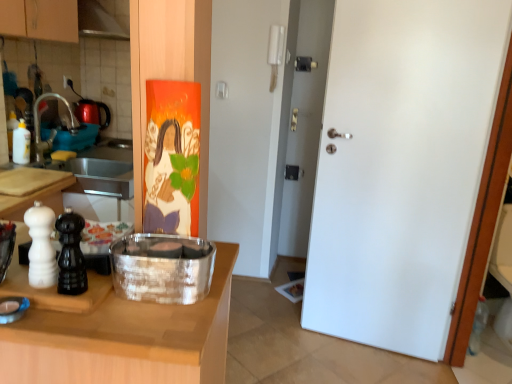
Question: Does silver metallic container at center have a greater width compared to wooden cutting board at left, which appears as the 2th countertop when viewed from the top?

Choices:
 (A) no
 (B) yes

Answer: (A)

Question: Can wooden cutting board at left, which appears as the 2th countertop when viewed from the top, be found inside silver metallic container at center?

Choices:
 (A) no
 (B) yes

Answer: (A)

Question: Can you confirm if silver metallic container at center is bigger than wooden cutting board at left, which appears as the 2th countertop when viewed from the top?

Choices:
 (A) no
 (B) yes

Answer: (A)

Question: Is silver metallic container at center at the right side of wooden cutting board at left, marked as the 1th countertop in a bottom-to-top arrangement?

Choices:
 (A) no
 (B) yes

Answer: (B)

Question: From a real-world perspective, is silver metallic container at center positioned under wooden cutting board at left, which appears as the 2th countertop when viewed from the top, based on gravity?

Choices:
 (A) yes
 (B) no

Answer: (B)

Question: Can you confirm if silver metallic container at center is taller than wooden cutting board at left, which appears as the 2th countertop when viewed from the top?

Choices:
 (A) yes
 (B) no

Answer: (B)

Question: Is brushed metal faucet at left looking in the opposite direction of wooden cutting board at left, marked as the second countertop in a bottom-to-top arrangement?

Choices:
 (A) yes
 (B) no

Answer: (B)

Question: Considering the relative sizes of brushed metal faucet at left and wooden cutting board at left, marked as the second countertop in a bottom-to-top arrangement, in the image provided, is brushed metal faucet at left smaller than wooden cutting board at left, marked as the second countertop in a bottom-to-top arrangement,?

Choices:
 (A) yes
 (B) no

Answer: (B)

Question: Can you confirm if brushed metal faucet at left is bigger than wooden cutting board at left, marked as the 1th countertop in a top-to-bottom arrangement?

Choices:
 (A) no
 (B) yes

Answer: (B)

Question: From a real-world perspective, is brushed metal faucet at left beneath wooden cutting board at left, marked as the second countertop in a bottom-to-top arrangement?

Choices:
 (A) yes
 (B) no

Answer: (B)

Question: Is brushed metal faucet at left outside of wooden cutting board at left, marked as the second countertop in a bottom-to-top arrangement?

Choices:
 (A) no
 (B) yes

Answer: (B)

Question: From the image's perspective, is brushed metal faucet at left located above wooden cutting board at left, marked as the 1th countertop in a top-to-bottom arrangement?

Choices:
 (A) yes
 (B) no

Answer: (A)

Question: Is wooden cutting board at left, marked as the 1th countertop in a bottom-to-top arrangement, positioned beyond the bounds of white glossy bottle at left?

Choices:
 (A) yes
 (B) no

Answer: (A)